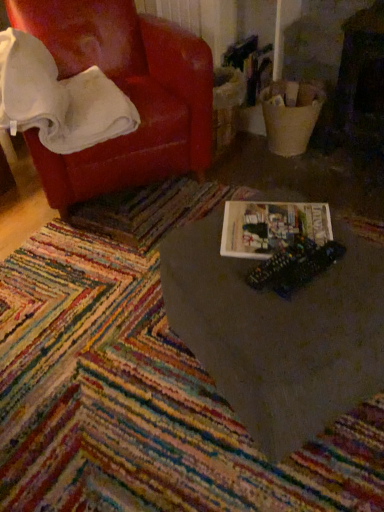
Question: Is white soft blanket at upper left bigger than hardcover book at center?

Choices:
 (A) yes
 (B) no

Answer: (A)

Question: Does white soft blanket at upper left have a lesser height compared to hardcover book at center?

Choices:
 (A) no
 (B) yes

Answer: (A)

Question: Is white soft blanket at upper left positioned with its back to hardcover book at center?

Choices:
 (A) no
 (B) yes

Answer: (A)

Question: From the image's perspective, does white soft blanket at upper left appear higher than hardcover book at center?

Choices:
 (A) yes
 (B) no

Answer: (A)

Question: From a real-world perspective, does white soft blanket at upper left stand above hardcover book at center?

Choices:
 (A) yes
 (B) no

Answer: (A)

Question: In terms of width, does leather-like red armchair at upper left look wider or thinner when compared to multicolored woven mat at center?

Choices:
 (A) wide
 (B) thin

Answer: (B)

Question: From a real-world perspective, is leather-like red armchair at upper left positioned above or below multicolored woven mat at center?

Choices:
 (A) above
 (B) below

Answer: (A)

Question: Would you say leather-like red armchair at upper left is to the left or to the right of multicolored woven mat at center in the picture?

Choices:
 (A) right
 (B) left

Answer: (B)

Question: Considering the positions of leather-like red armchair at upper left and multicolored woven mat at center in the image, is leather-like red armchair at upper left bigger or smaller than multicolored woven mat at center?

Choices:
 (A) big
 (B) small

Answer: (A)

Question: In terms of size, does hardcover book at center appear bigger or smaller than metallic plastic toy at center?

Choices:
 (A) big
 (B) small

Answer: (A)

Question: Considering the positions of hardcover book at center and metallic plastic toy at center in the image, is hardcover book at center wider or thinner than metallic plastic toy at center?

Choices:
 (A) wide
 (B) thin

Answer: (B)

Question: From the image's perspective, is hardcover book at center located above or below metallic plastic toy at center?

Choices:
 (A) above
 (B) below

Answer: (A)

Question: In the image, is hardcover book at center positioned in front of or behind metallic plastic toy at center?

Choices:
 (A) behind
 (B) front

Answer: (A)

Question: Considering the positions of metallic plastic toy at center and hardcover book at center in the image, is metallic plastic toy at center taller or shorter than hardcover book at center?

Choices:
 (A) tall
 (B) short

Answer: (A)

Question: Is point (301, 245) positioned closer to the camera than point (317, 207)?

Choices:
 (A) farther
 (B) closer

Answer: (B)